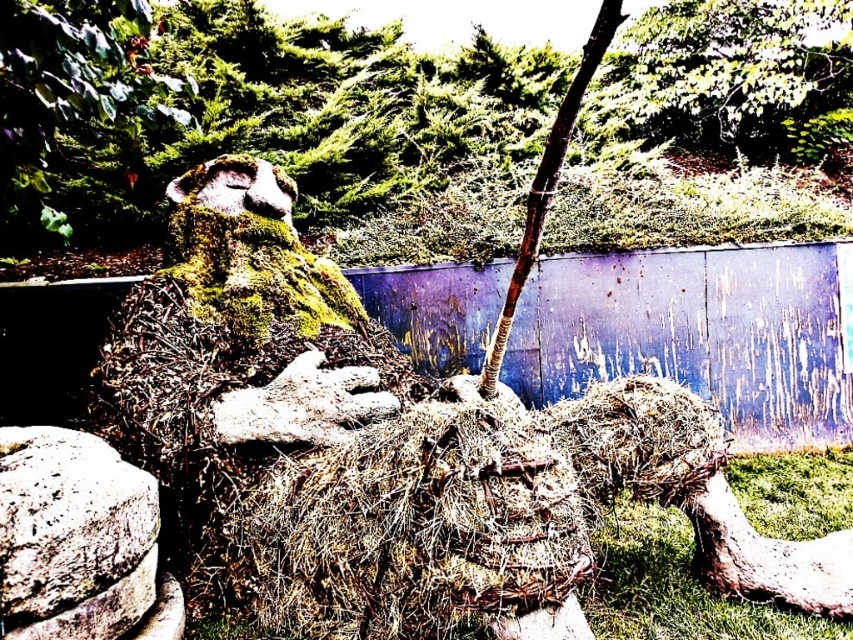
Question: Is green mossy tree at upper left to the left of gray rough stone at lower left from the viewer's perspective?

Choices:
 (A) no
 (B) yes

Answer: (A)

Question: Estimate the real-world distances between objects in this image. Which object is closer to the dry straw at center?

Choices:
 (A) green mossy tree at upper left
 (B) gray rough stone at lower left

Answer: (B)

Question: Is green mossy tree at upper left positioned behind dry straw at center?

Choices:
 (A) yes
 (B) no

Answer: (A)

Question: Can you confirm if dry straw at center is wider than gray rough stone at lower left?

Choices:
 (A) yes
 (B) no

Answer: (A)

Question: Which object appears closest to the camera in this image?

Choices:
 (A) gray rough stone at lower left
 (B) dry straw at center

Answer: (A)

Question: Which object appears farthest from the camera in this image?

Choices:
 (A) green mossy tree at upper left
 (B) dry straw at center
 (C) gray rough stone at lower left

Answer: (A)